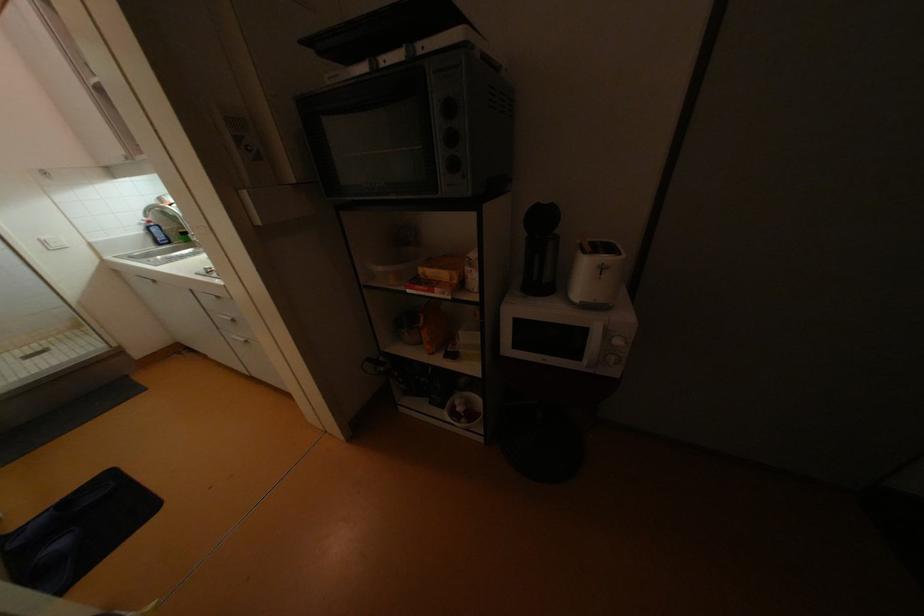
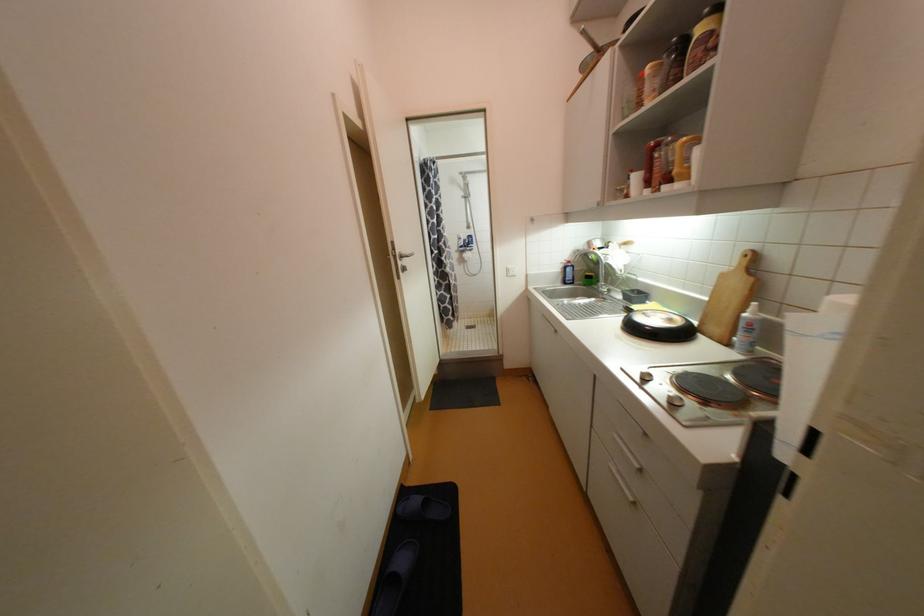
The point at (49, 243) is marked in the first image. Where is the corresponding point in the second image?

(513, 270)